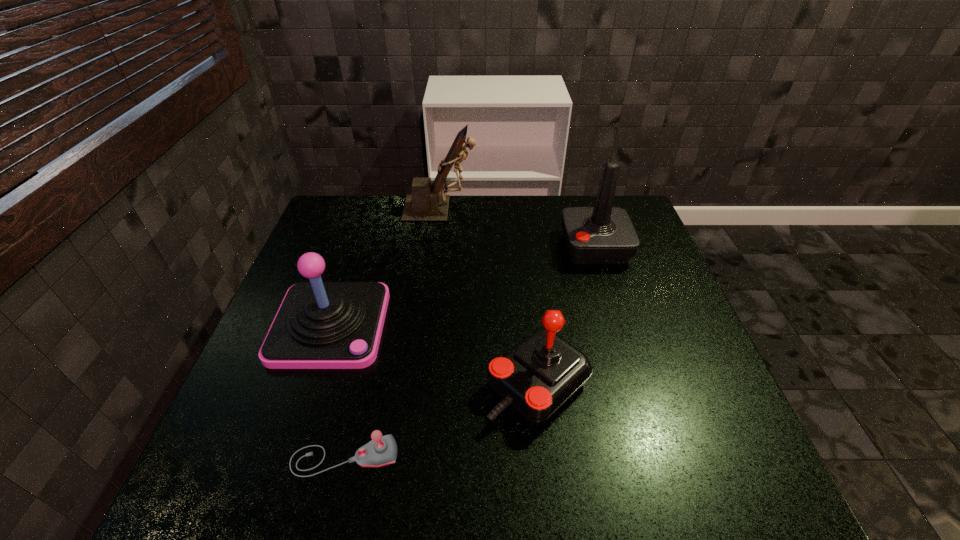
Locate an element on the screen. figurine is located at coordinates (425, 204).

Identify the location of the tallest joystick. (603, 234).

Identify the location of the farthest joystick. (603, 234).

In order to click on the fourth object from left to right in this screenshot , I will do `click(539, 375)`.

Identify the location of the nearest object. This screenshot has width=960, height=540. (382, 450).

Find the location of a particular element. The width and height of the screenshot is (960, 540). the shortest object is located at coordinates (382, 450).

This screenshot has height=540, width=960. In order to click on vacant space situated 0.210m on the front-facing side of the farthest object in this screenshot , I will do `click(540, 209)`.

Where is `free space located on the back of the rightmost joystick`? Image resolution: width=960 pixels, height=540 pixels. free space located on the back of the rightmost joystick is located at coordinates (583, 208).

Locate an element on the screen. Image resolution: width=960 pixels, height=540 pixels. vacant space situated on the right of the third joystick from left to right is located at coordinates (636, 384).

Where is `vacant space located 0.370m on the back of the shortest joystick`? This screenshot has height=540, width=960. vacant space located 0.370m on the back of the shortest joystick is located at coordinates (380, 303).